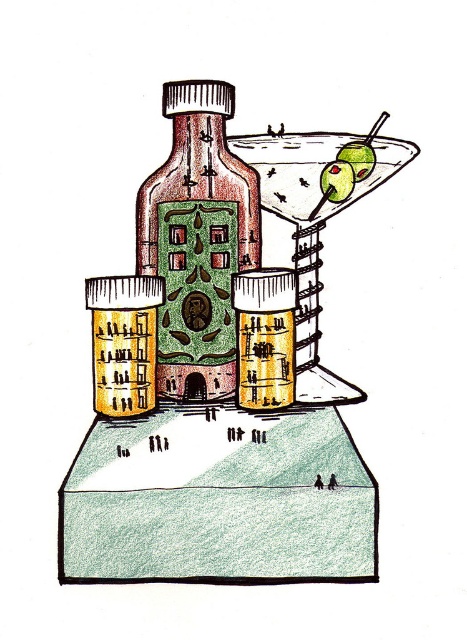
You are a bartender preparing a cocktail. You have a matte glass bottle at center and a shiny glass martini at upper right in front of you. Which container should you pour the liquid into if you want to use the taller one?

The matte glass bottle at center is taller than the shiny glass martini at upper right, so you should pour the liquid into the matte glass bottle at center.

You are a bartender preparing a drink. You have a matte glass bottle at center and a shiny glass martini at upper right. Which container can hold more liquid based on their widths?

The shiny glass martini at upper right can hold more liquid because its width is greater than the matte glass bottle at center.

You are at a bar and want to grab the green matte olive at upper center from the martini glass. The martini glass is to the right of the matte glass bottle at center. Can you reach the olive without moving the bottle?

The matte glass bottle at center is closer to the viewer than the green matte olive at upper center, so you would need to move the bottle to access the olive.